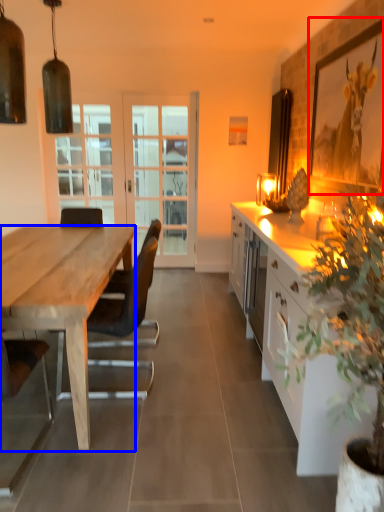
Question: Which object is closer to the camera taking this photo, picture frame (highlighted by a red box) or desk (highlighted by a blue box)?

Choices:
 (A) picture frame
 (B) desk

Answer: (B)